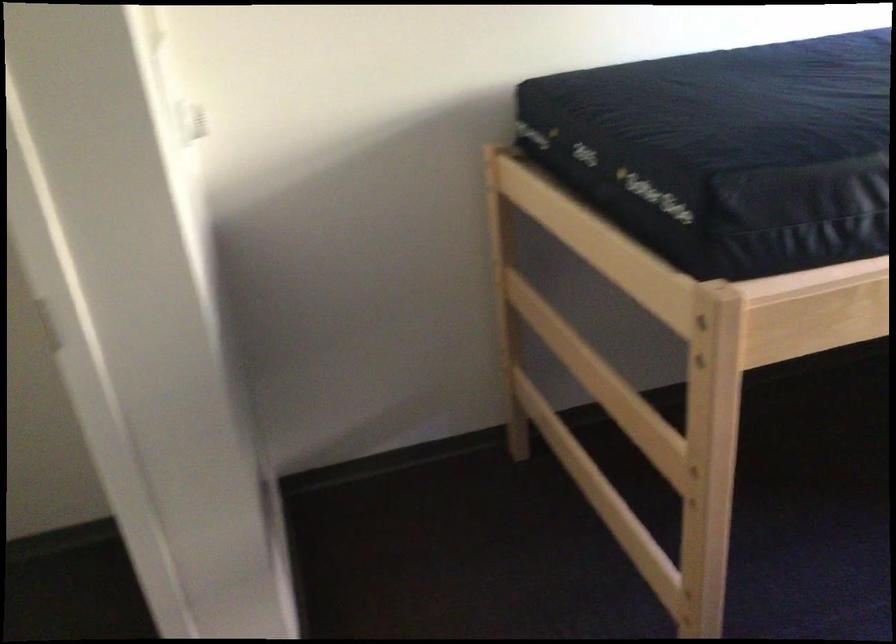
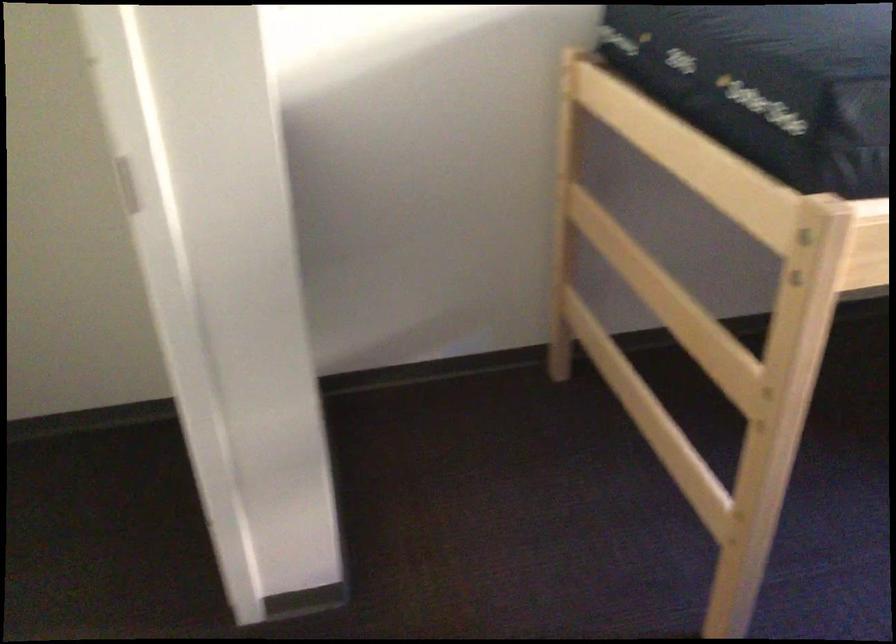
Question: The images are taken continuously from a first-person perspective. In which direction are you moving?

Choices:
 (A) Left
 (B) Right
 (C) Forward
 (D) Backward

Answer: (A)